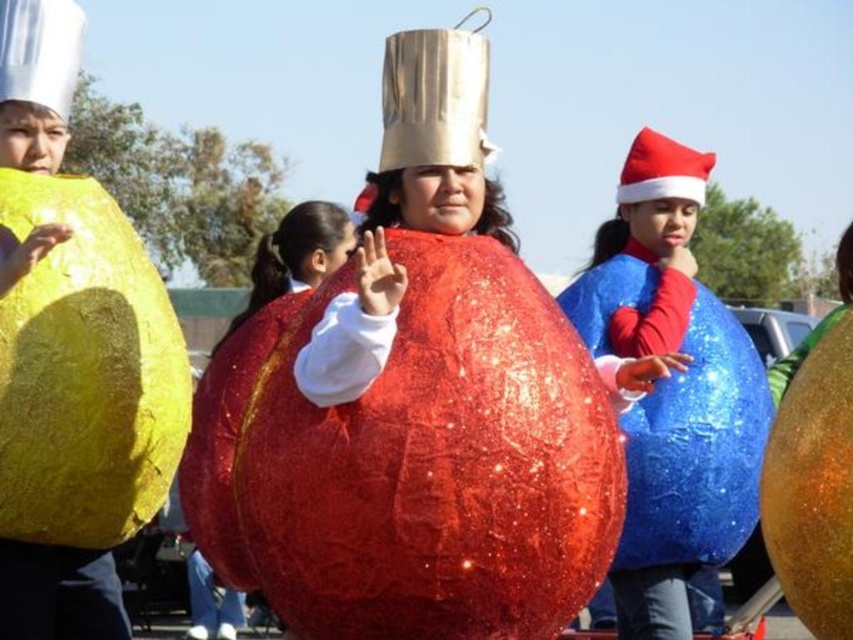
Question: Can you confirm if blue sparkly balloon at right is positioned to the right of metallic silver chef hat at center?

Choices:
 (A) no
 (B) yes

Answer: (B)

Question: Among these points, which one is farthest from the camera?

Choices:
 (A) (485, 154)
 (B) (570, 420)
 (C) (701, 515)

Answer: (C)

Question: Does shiny red balloon at center appear on the right side of red felt santa hat at upper right?

Choices:
 (A) yes
 (B) no

Answer: (B)

Question: Which object appears farthest from the camera in this image?

Choices:
 (A) blue sparkly balloon at right
 (B) metallic silver chef hat at center
 (C) white paper christmas hat at upper left
 (D) shiny red balloon at center

Answer: (D)

Question: Which point is farther to the camera?

Choices:
 (A) (20, 67)
 (B) (579, 544)
 (C) (689, 346)
 (D) (704, 152)

Answer: (D)

Question: Is shiny red balloon at center above white paper christmas hat at upper left?

Choices:
 (A) no
 (B) yes

Answer: (A)